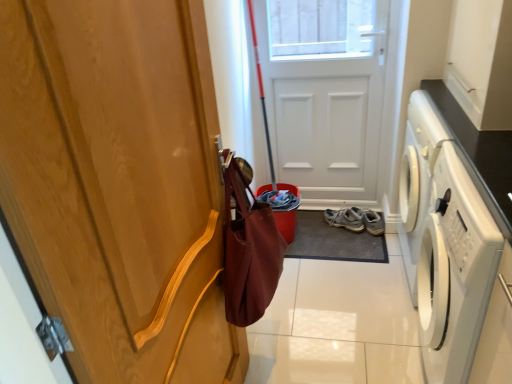
Question: Can you confirm if white matte door at center, which ranks as the 1th door in right-to-left order, is positioned to the right of light brown suede sneakers at lower center?

Choices:
 (A) yes
 (B) no

Answer: (B)

Question: Considering the relative sizes of white matte door at center, which ranks as the 1th door in right-to-left order, and light brown suede sneakers at lower center in the image provided, is white matte door at center, which ranks as the 1th door in right-to-left order, taller than light brown suede sneakers at lower center?

Choices:
 (A) no
 (B) yes

Answer: (B)

Question: From a real-world perspective, is white matte door at center, marked as the 1th door in a back-to-front arrangement, physically below light brown suede sneakers at lower center?

Choices:
 (A) yes
 (B) no

Answer: (B)

Question: Is white matte door at center, the 2th door when ordered from front to back, facing towards light brown suede sneakers at lower center?

Choices:
 (A) no
 (B) yes

Answer: (B)

Question: Is white matte door at center, marked as the 1th door in a back-to-front arrangement, wider than light brown suede sneakers at lower center?

Choices:
 (A) yes
 (B) no

Answer: (B)

Question: In the image, is light brown suede sneakers at lower center positioned in front of or behind wooden door handle at left, which is the second door in right-to-left order?

Choices:
 (A) front
 (B) behind

Answer: (B)

Question: Looking at the image, does light brown suede sneakers at lower center seem bigger or smaller compared to wooden door handle at left, which is the 1th door from front to back?

Choices:
 (A) big
 (B) small

Answer: (B)

Question: In terms of height, does light brown suede sneakers at lower center look taller or shorter compared to wooden door handle at left, marked as the 2th door in a back-to-front arrangement?

Choices:
 (A) tall
 (B) short

Answer: (B)

Question: From the image's perspective, is light brown suede sneakers at lower center located above or below wooden door handle at left, which is the second door in right-to-left order?

Choices:
 (A) above
 (B) below

Answer: (B)

Question: Is white glossy washing machine at right inside or outside of wooden door handle at left, which is the second door in right-to-left order?

Choices:
 (A) inside
 (B) outside

Answer: (B)

Question: In terms of height, does white glossy washing machine at right look taller or shorter compared to wooden door handle at left, which is the 1th door in left-to-right order?

Choices:
 (A) tall
 (B) short

Answer: (B)

Question: From a real-world perspective, is white glossy washing machine at right above or below wooden door handle at left, which is the second door in right-to-left order?

Choices:
 (A) above
 (B) below

Answer: (B)

Question: Would you say white glossy washing machine at right is to the left or to the right of wooden door handle at left, which is the second door in right-to-left order, in the picture?

Choices:
 (A) left
 (B) right

Answer: (B)

Question: From the image's perspective, is wooden door handle at left, which is the 1th door from front to back, positioned above or below white matte door at center, placed as the second door when sorted from left to right?

Choices:
 (A) above
 (B) below

Answer: (B)

Question: Considering the relative positions of wooden door handle at left, marked as the 2th door in a back-to-front arrangement, and white matte door at center, marked as the 1th door in a back-to-front arrangement, in the image provided, is wooden door handle at left, marked as the 2th door in a back-to-front arrangement, to the left or to the right of white matte door at center, marked as the 1th door in a back-to-front arrangement,?

Choices:
 (A) left
 (B) right

Answer: (A)